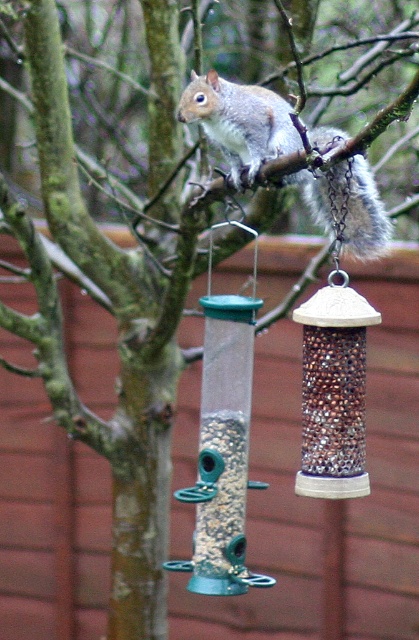
Does gray furry squirrel at upper center appear on the right side of shiny metallic seed at center?

Incorrect, gray furry squirrel at upper center is not on the right side of shiny metallic seed at center.

What do you see at coordinates (240, 122) in the screenshot? Image resolution: width=419 pixels, height=640 pixels. I see `gray furry squirrel at upper center` at bounding box center [240, 122].

At what (x,y) coordinates should I click in order to perform the action: click on gray furry squirrel at upper center. Please return your answer as a coordinate pair (x, y). The image size is (419, 640). Looking at the image, I should click on (240, 122).

What do you see at coordinates (240, 122) in the screenshot? This screenshot has height=640, width=419. I see `gray furry squirrel at upper center` at bounding box center [240, 122].

Who is shorter, gray furry squirrel at upper center or brown textured seed at lower center?

With less height is brown textured seed at lower center.

I want to click on gray furry squirrel at upper center, so [x=240, y=122].

Locate an element on the screen. Image resolution: width=419 pixels, height=640 pixels. gray furry squirrel at upper center is located at coordinates (240, 122).

Can you confirm if shiny metallic seed at center is shorter than brown textured seed at lower center?

Correct, shiny metallic seed at center is not as tall as brown textured seed at lower center.

Who is more distant from viewer, (x=302, y=468) or (x=229, y=486)?

Point (x=229, y=486)

The image size is (419, 640). Identify the location of shiny metallic seed at center. (333, 401).